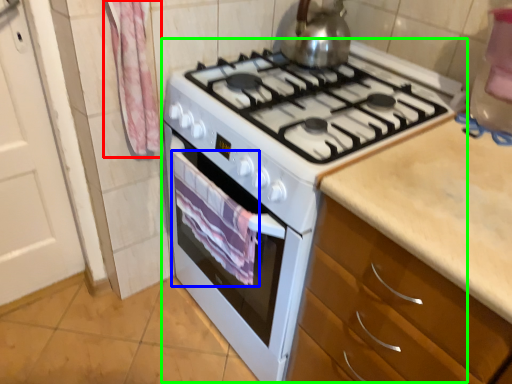
Question: Which object is positioned farthest from curtain (highlighted by a red box)? Select from blanket (highlighted by a blue box) and appliance (highlighted by a green box).

Choices:
 (A) blanket
 (B) appliance

Answer: (B)